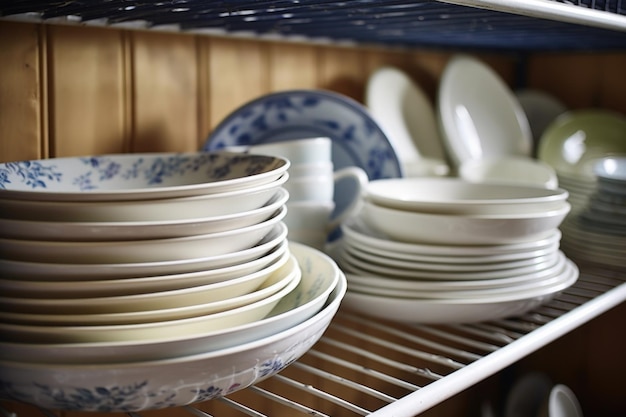
Identify the location of mugs. The width and height of the screenshot is (626, 417). (305, 152), (314, 166), (314, 187), (310, 225).